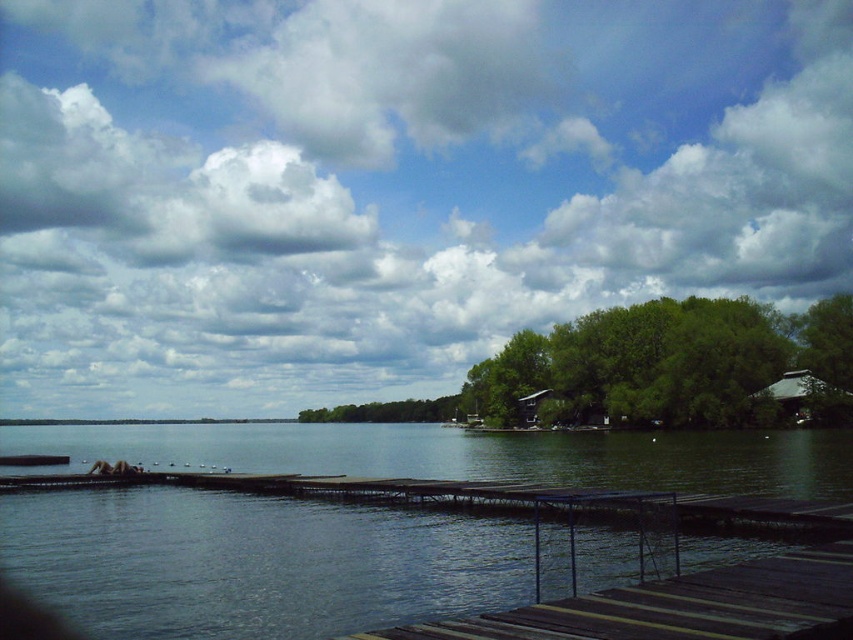
Between white fluffy cloud at upper center and transparent water at center, which one is positioned lower?

Positioned lower is transparent water at center.

Is white fluffy cloud at upper center positioned at the back of transparent water at center?

Yes, white fluffy cloud at upper center is further from the viewer.

Does point (163, 173) lie in front of point (148, 609)?

No, (163, 173) is behind (148, 609).

Identify the location of white fluffy cloud at upper center. The width and height of the screenshot is (853, 640). (393, 184).

Is green leafy trees at center to the right of wooden planks at center from the viewer's perspective?

Indeed, green leafy trees at center is positioned on the right side of wooden planks at center.

Is green leafy trees at center above wooden planks at center?

Incorrect, green leafy trees at center is not positioned above wooden planks at center.

The height and width of the screenshot is (640, 853). In order to click on green leafy trees at center in this screenshot , I will do [648, 369].

Can you confirm if white fluffy cloud at upper center is smaller than green leafy trees at center?

No, white fluffy cloud at upper center is not smaller than green leafy trees at center.

Is point (59, 323) positioned in front of point (837, 346)?

No, (59, 323) is further to viewer.

Locate an element on the screen. The width and height of the screenshot is (853, 640). white fluffy cloud at upper center is located at coordinates (393, 184).